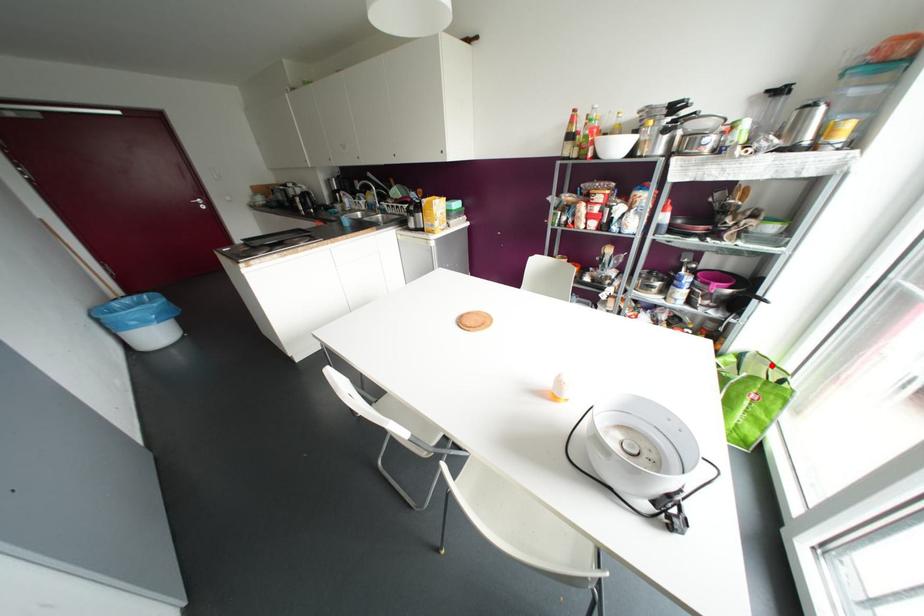
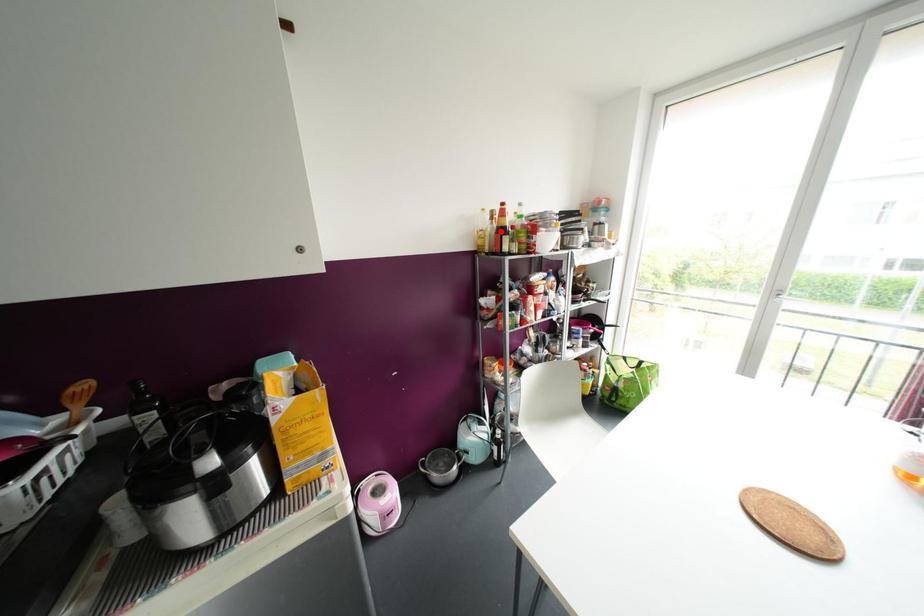
I am providing you with two images of the same scene from different viewpoints. A red point is marked on the first image and another point is marked on the second image. Is the red point in image1 aligned with the point shown in image2?

No